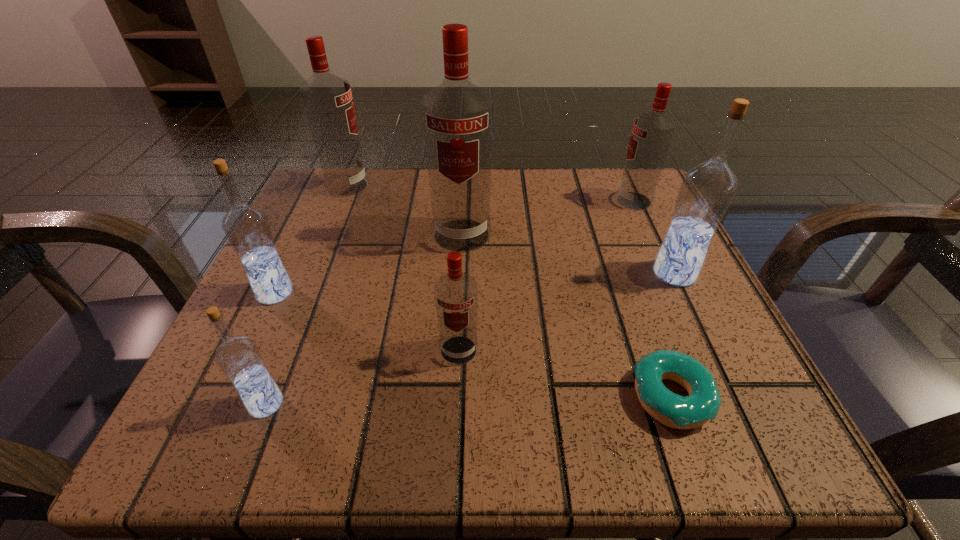
Find the location of `vacant space at the left edge of the desktop`. vacant space at the left edge of the desktop is located at coordinates (331, 289).

The height and width of the screenshot is (540, 960). In the image, there is a desktop. What are the coordinates of `free space at the right edge` in the screenshot? It's located at (612, 270).

This screenshot has width=960, height=540. What are the coordinates of `vacant space at the near left corner of the desktop` in the screenshot? It's located at (297, 408).

In the image, there is a desktop. Identify the location of vacant space at the far right corner. This screenshot has width=960, height=540. (670, 219).

In the image, there is a desktop. Where is `vacant space at the near right corner`? vacant space at the near right corner is located at coordinates (763, 396).

Where is `vacant space in between the tallest object and the biggest blue vodka`? vacant space in between the tallest object and the biggest blue vodka is located at coordinates (568, 254).

Locate an element on the screen. vacant space that is in between the second biggest blue vodka and the smallest red vodka is located at coordinates (x=367, y=321).

The height and width of the screenshot is (540, 960). I want to click on empty location between the nearest red vodka and the second smallest red vodka, so click(x=546, y=275).

Where is `empty space between the shortest object and the tallest vodka`? empty space between the shortest object and the tallest vodka is located at coordinates (566, 316).

Find the location of a particular element. This screenshot has width=960, height=540. free space that is in between the nearest blue vodka and the leftmost blue vodka is located at coordinates (271, 348).